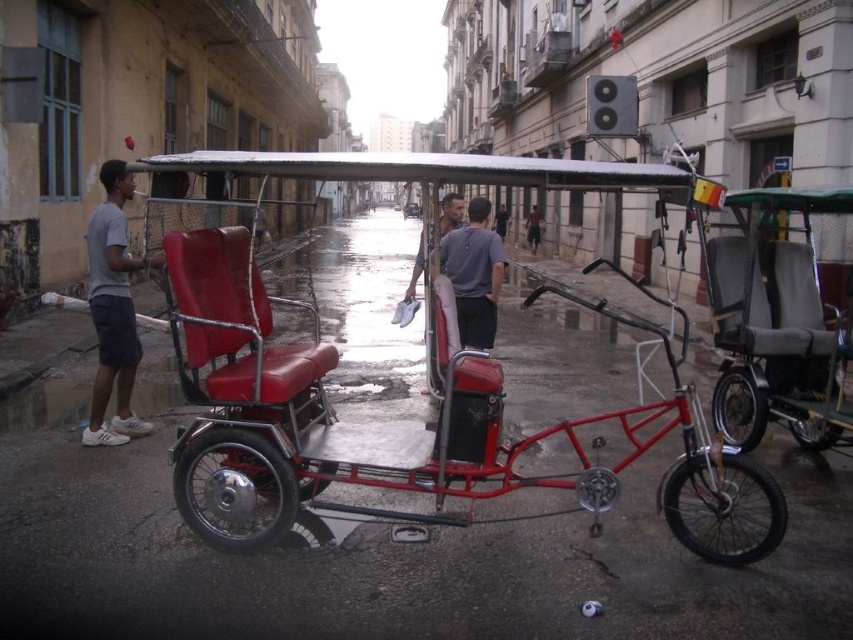
Which is above, metallic red tricycle at center or skinny jeans at center?

skinny jeans at center is higher up.

Based on the photo, measure the distance between metallic red tricycle at center and camera.

They are 12.91 feet apart.

Locate an element on the screen. Image resolution: width=853 pixels, height=640 pixels. metallic red tricycle at center is located at coordinates (384, 422).

Is matte gray shirt at center positioned at the back of gray fabric shirt at center?

No, matte gray shirt at center is in front of gray fabric shirt at center.

Can you confirm if matte gray shirt at center is positioned to the right of gray fabric shirt at center?

In fact, matte gray shirt at center is to the left of gray fabric shirt at center.

Which is behind, point (469, 266) or point (500, 208)?

Point (500, 208)

This screenshot has height=640, width=853. Identify the location of matte gray shirt at center. (474, 275).

Is point (235, 154) more distant than point (91, 232)?

No.

Find the location of a particular element. Image resolution: width=853 pixels, height=640 pixels. metallic red tricycle at center is located at coordinates (384, 422).